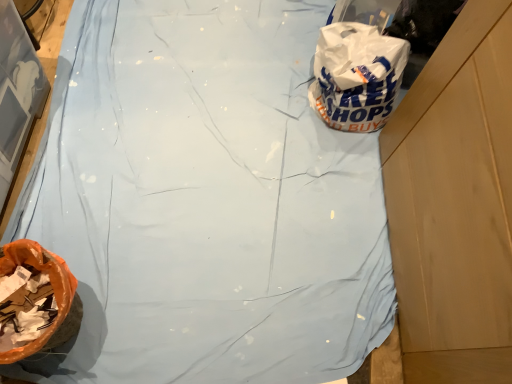
Question: Considering the relative sizes of orange plastic bag at lower left and white plastic bag at upper right in the image provided, is orange plastic bag at lower left wider than white plastic bag at upper right?

Choices:
 (A) no
 (B) yes

Answer: (A)

Question: Is orange plastic bag at lower left outside white plastic bag at upper right?

Choices:
 (A) no
 (B) yes

Answer: (B)

Question: Considering the relative sizes of orange plastic bag at lower left and white plastic bag at upper right in the image provided, is orange plastic bag at lower left thinner than white plastic bag at upper right?

Choices:
 (A) no
 (B) yes

Answer: (B)

Question: Does orange plastic bag at lower left come behind white plastic bag at upper right?

Choices:
 (A) yes
 (B) no

Answer: (B)

Question: Can you confirm if orange plastic bag at lower left is bigger than white plastic bag at upper right?

Choices:
 (A) yes
 (B) no

Answer: (B)

Question: Considering the relative sizes of orange plastic bag at lower left and white plastic bag at upper right in the image provided, is orange plastic bag at lower left shorter than white plastic bag at upper right?

Choices:
 (A) yes
 (B) no

Answer: (B)

Question: From a real-world perspective, is white plastic bag at upper right on orange plastic bag at lower left?

Choices:
 (A) no
 (B) yes

Answer: (A)

Question: Considering the relative sizes of white plastic bag at upper right and orange plastic bag at lower left in the image provided, is white plastic bag at upper right smaller than orange plastic bag at lower left?

Choices:
 (A) no
 (B) yes

Answer: (A)

Question: Is white plastic bag at upper right at the left side of orange plastic bag at lower left?

Choices:
 (A) yes
 (B) no

Answer: (B)

Question: Are white plastic bag at upper right and orange plastic bag at lower left beside each other?

Choices:
 (A) yes
 (B) no

Answer: (B)

Question: Is white plastic bag at upper right taller than orange plastic bag at lower left?

Choices:
 (A) no
 (B) yes

Answer: (A)

Question: Is the position of white plastic bag at upper right less distant than that of orange plastic bag at lower left?

Choices:
 (A) no
 (B) yes

Answer: (A)

Question: Considering their positions, is orange plastic bag at lower left located in front of or behind white plastic bag at upper right?

Choices:
 (A) front
 (B) behind

Answer: (A)